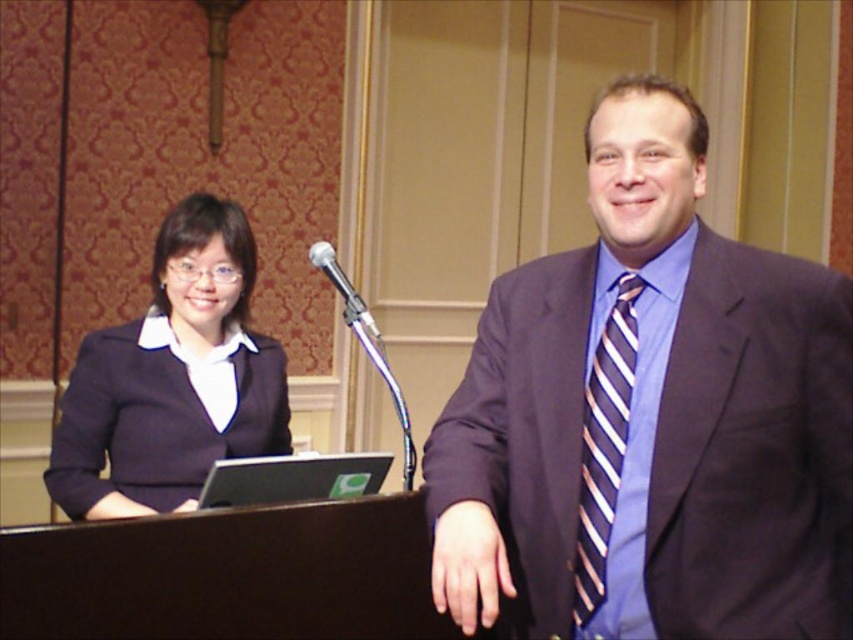
You are organizing a small event and need to place a decorative item on the podium. The podium currently has the metallic silver microphone at center. If you want to add the dark purple suit at right on the podium, will it fit without overlapping the microphone?

The dark purple suit at right has a larger size compared to the metallic silver microphone at center. Since the suit is larger, placing it on the podium alongside the microphone may cause overlapping, so it might not fit without overlapping.

You are an event planner arranging the stage for a presentation. You need to ensure that the matte black blazer at left and the metallic silver microphone at center are visible to the audience. Based on their positions, which object is closer to the front of the stage?

The matte black blazer at left is closer to the front of the stage because the metallic silver microphone at center is behind it.

You are a photographer positioned behind the metallic silver microphone at center. You want to take a photo of the person wearing the dark purple suit at right. Can you see their face clearly from your current position?

The dark purple suit at right is in front of the metallic silver microphone at center, so the photographer cannot see the face of the person in the dark purple suit at right clearly from behind the microphone.